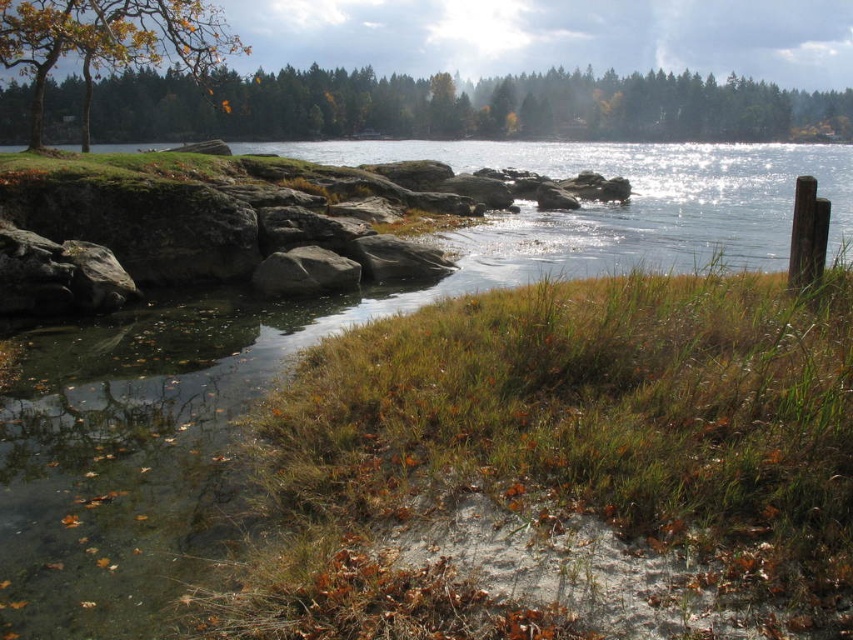
Question: Does green matte tree at upper center have a smaller size compared to brown textured tree at upper left?

Choices:
 (A) yes
 (B) no

Answer: (A)

Question: Estimate the real-world distances between objects in this image. Which object is closer to the gray rough rock at center?

Choices:
 (A) green matte tree at upper center
 (B) brown textured tree at upper left

Answer: (B)

Question: Does brown textured tree at upper left have a larger size compared to gray rough rock at center?

Choices:
 (A) yes
 (B) no

Answer: (A)

Question: Based on their relative distances, which object is farther from the green matte tree at upper center?

Choices:
 (A) brown textured tree at upper left
 (B) gray rough rock at center

Answer: (B)

Question: Which of the following is the closest to the observer?

Choices:
 (A) (57, 109)
 (B) (341, 256)
 (C) (219, 35)

Answer: (B)

Question: Is green matte tree at upper center wider than brown textured tree at upper left?

Choices:
 (A) no
 (B) yes

Answer: (B)